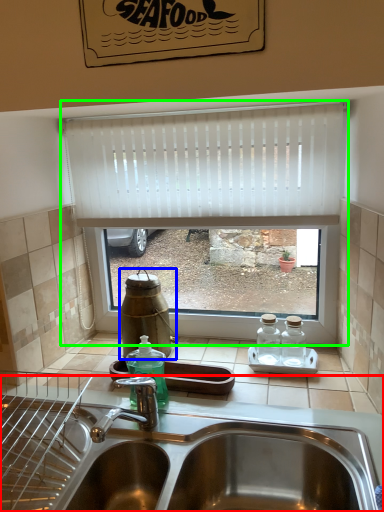
Question: Based on their relative distances, which object is farther from sink (highlighted by a red box)? Choose from bottle (highlighted by a blue box) and window (highlighted by a green box).

Choices:
 (A) bottle
 (B) window

Answer: (B)